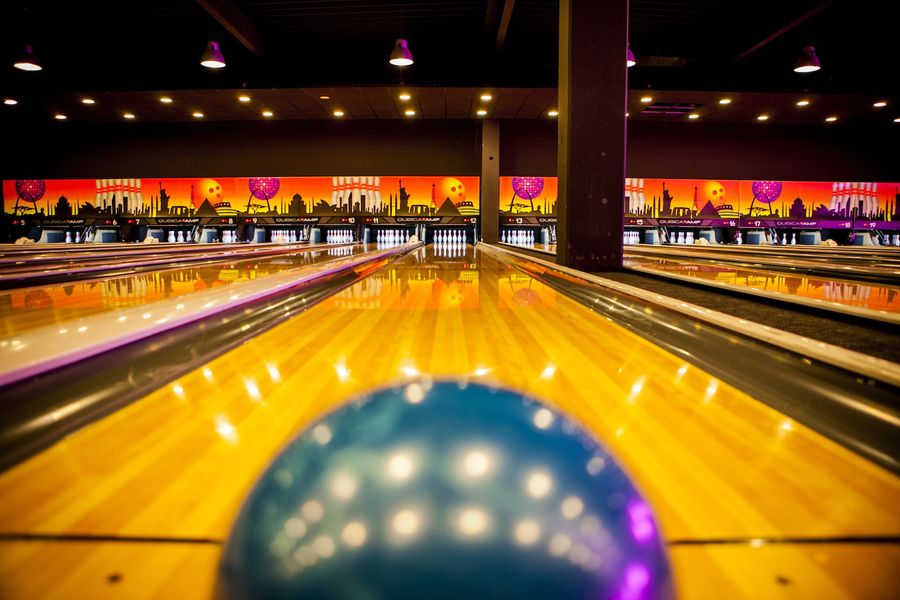
Where is `disco ball artwork`? disco ball artwork is located at coordinates (27, 189), (266, 182), (518, 184), (763, 190).